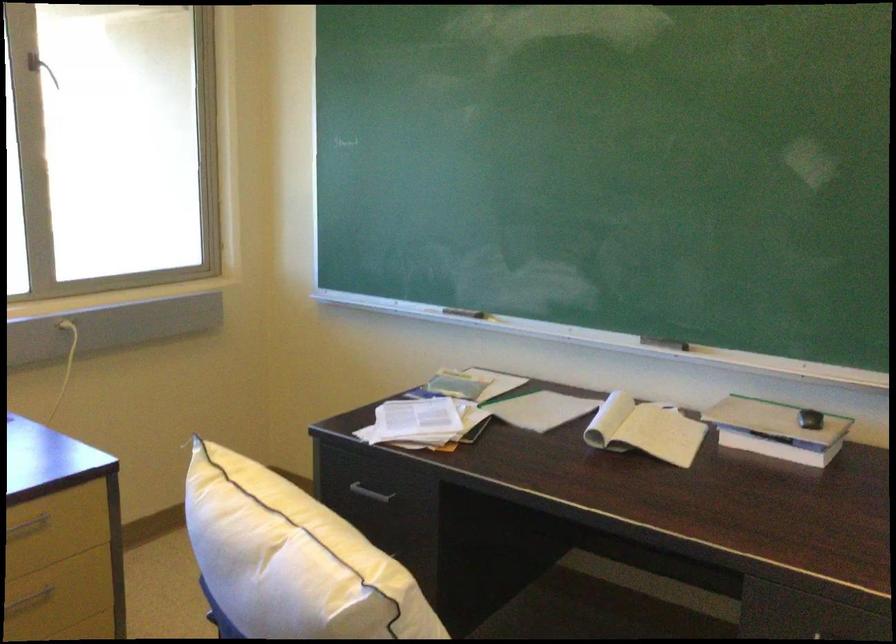
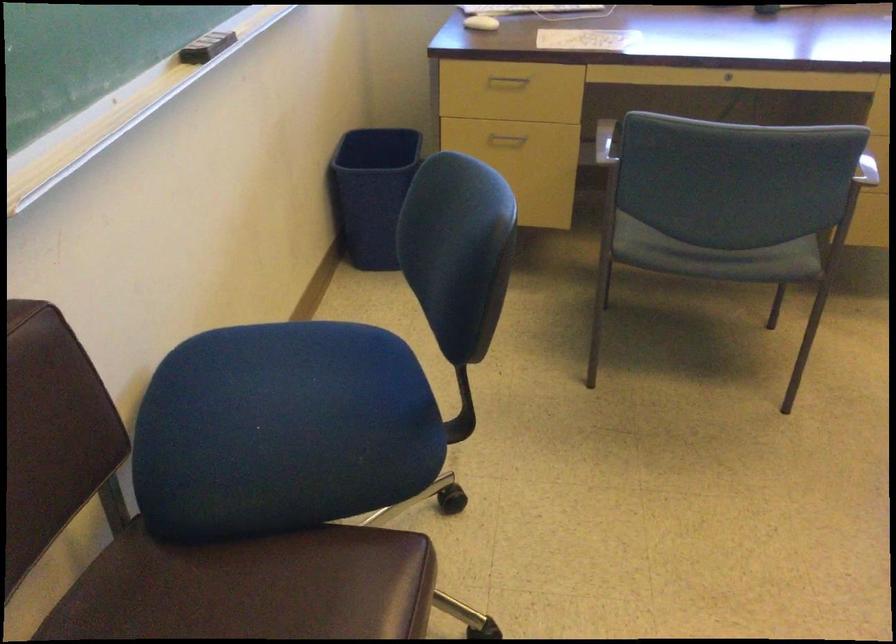
Based on the continuous images, in which direction is the camera rotating?

The rotation direction of the camera is left-down.